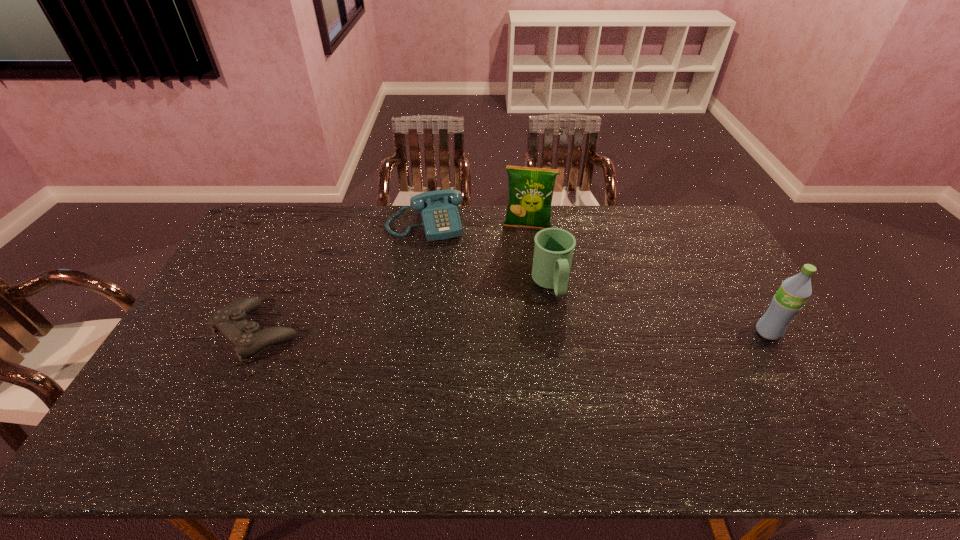
You are a GUI agent. You are given a task and a screenshot of the screen. Output one action in this format:
    pyautogui.click(x=<x>, y=<y>)
    Task: Click on the free spot located 0.370m on the front-facing side of the crisp (potato chip)
    Image resolution: width=960 pixels, height=540 pixels.
    Given the screenshot: What is the action you would take?
    pyautogui.click(x=516, y=306)

This screenshot has width=960, height=540. What are the coordinates of `vacant position located 0.330m on the front-facing side of the crisp (potato chip)` in the screenshot? It's located at (516, 296).

This screenshot has width=960, height=540. Find the location of `free spot located on the side of the third tallest object with the handle`. free spot located on the side of the third tallest object with the handle is located at coordinates (571, 340).

Where is `free space located 0.170m on the side of the third tallest object with the handle`? free space located 0.170m on the side of the third tallest object with the handle is located at coordinates (574, 348).

This screenshot has width=960, height=540. What are the coordinates of `free space located on the side of the third tallest object with the handle` in the screenshot? It's located at (593, 398).

Locate an element on the screen. The image size is (960, 540). free space located on the dial of the telephone is located at coordinates (439, 263).

I want to click on free location located on the dial of the telephone, so click(x=445, y=285).

The width and height of the screenshot is (960, 540). Find the location of `free space located on the dial of the telephone`. free space located on the dial of the telephone is located at coordinates (437, 258).

Locate an element on the screen. crisp (potato chip) that is at the far edge is located at coordinates (531, 190).

At what (x,y) coordinates should I click in order to perform the action: click on telephone located in the far edge section of the desktop. Please return your answer as a coordinate pair (x, y). The image size is (960, 540). Looking at the image, I should click on (440, 218).